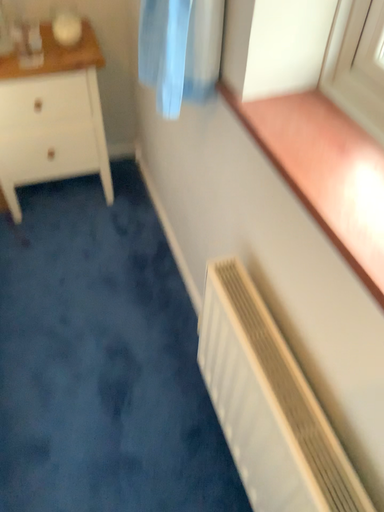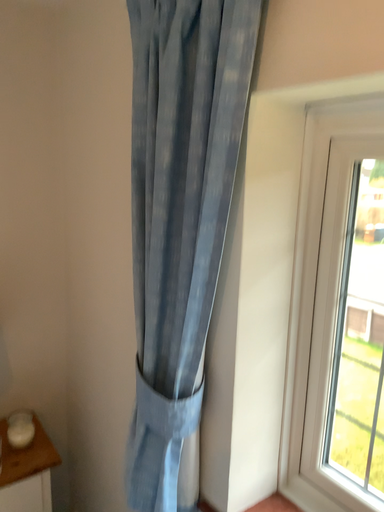
Question: Which way did the camera rotate in the video?

Choices:
 (A) rotated downward
 (B) rotated upward

Answer: (B)